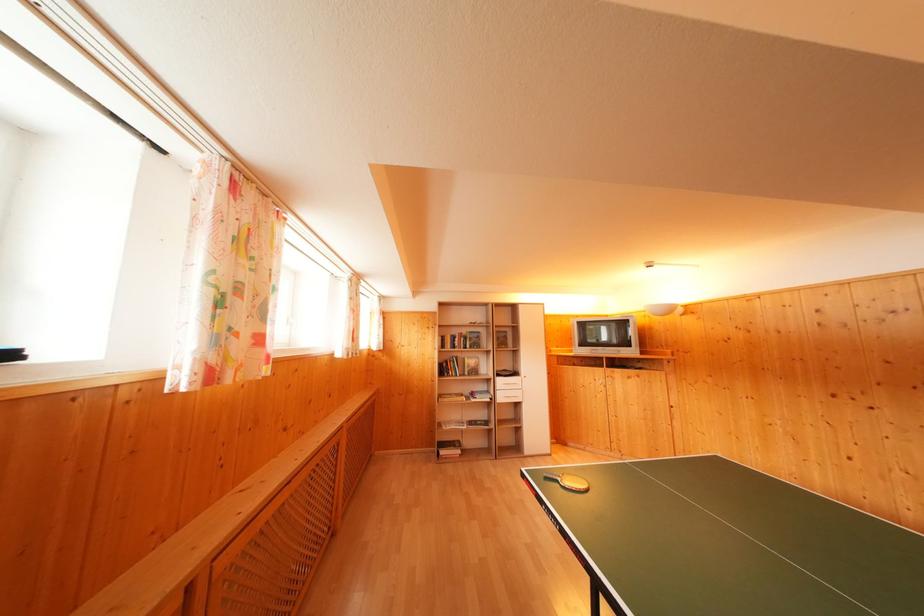
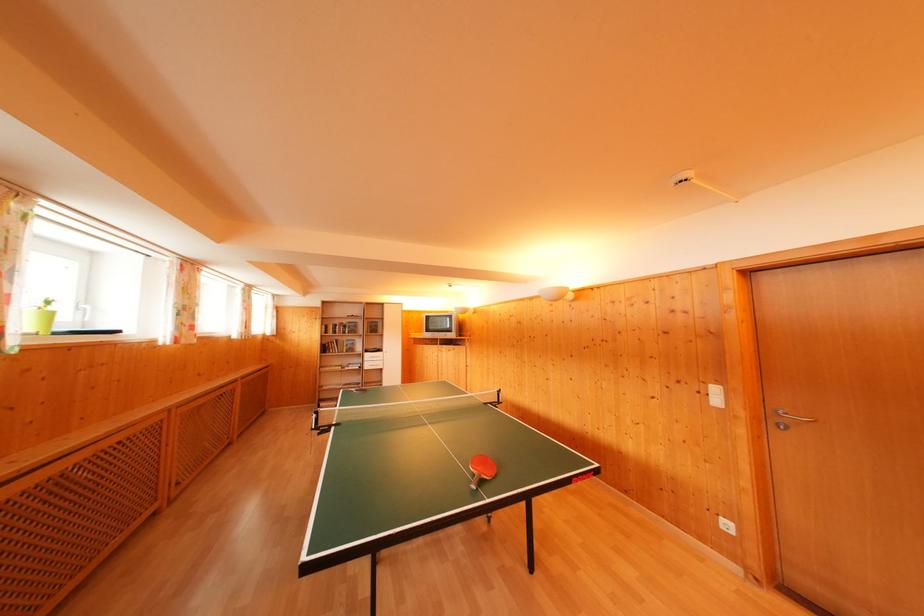
The point at (444, 358) is marked in the first image. Where is the corresponding point in the second image?

(326, 342)